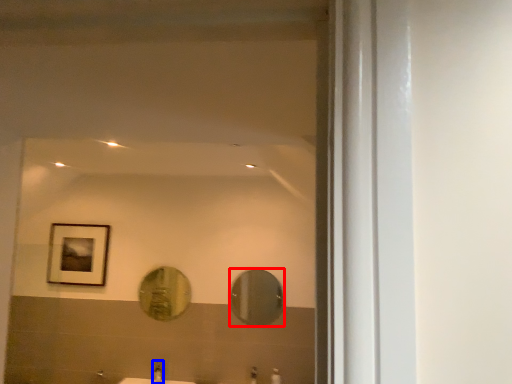
Question: Among these objects, which one is nearest to the camera, mirror (highlighted by a red box) or faucet (highlighted by a blue box)?

Choices:
 (A) mirror
 (B) faucet

Answer: (B)